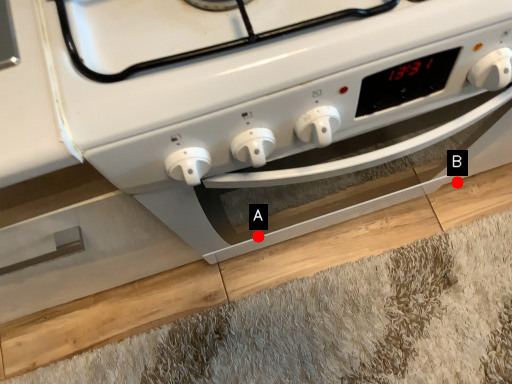
Question: Two points are circled on the image, labeled by A and B beside each circle. Which point is closer to the camera taking this photo?

Choices:
 (A) A is closer
 (B) B is closer

Answer: (A)